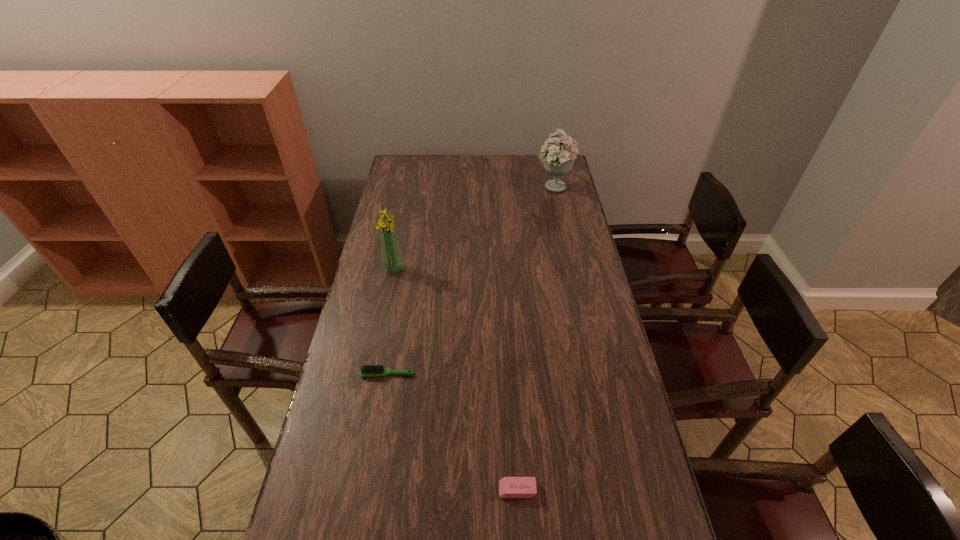
Locate which object is the closest to the nearer bouquet. Please provide its 2D coordinates. Your answer should be formatted as a tuple, i.e. [(x, y)], where the tuple contains the x and y coordinates of a point satisfying the conditions above.

[(368, 370)]

This screenshot has height=540, width=960. I want to click on vacant region that satisfies the following two spatial constraints: 1. on the front-facing side of the left bouquet; 2. on the right side of the third object from left to right, so click(349, 490).

Where is `vacant space that satisfies the following two spatial constraints: 1. on the front-facing side of the third farthest object; 2. on the left side of the left bouquet`? Image resolution: width=960 pixels, height=540 pixels. vacant space that satisfies the following two spatial constraints: 1. on the front-facing side of the third farthest object; 2. on the left side of the left bouquet is located at coordinates tap(372, 374).

The width and height of the screenshot is (960, 540). Identify the location of vacant region that satisfies the following two spatial constraints: 1. on the front-facing side of the nearer bouquet; 2. on the back side of the eraser. pyautogui.click(x=349, y=490).

Identify the location of free space that satisfies the following two spatial constraints: 1. on the front side of the farthest object; 2. on the front-facing side of the nearer bouquet. (571, 269).

This screenshot has width=960, height=540. In order to click on vacant region that satisfies the following two spatial constraints: 1. on the front-facing side of the second farthest object; 2. on the right side of the eraser in this screenshot , I will do `click(349, 490)`.

Locate an element on the screen. Image resolution: width=960 pixels, height=540 pixels. free point that satisfies the following two spatial constraints: 1. on the front-facing side of the left bouquet; 2. on the back side of the eraser is located at coordinates (349, 490).

I want to click on vacant region that satisfies the following two spatial constraints: 1. on the front side of the right bouquet; 2. on the front-facing side of the third nearest object, so click(x=571, y=269).